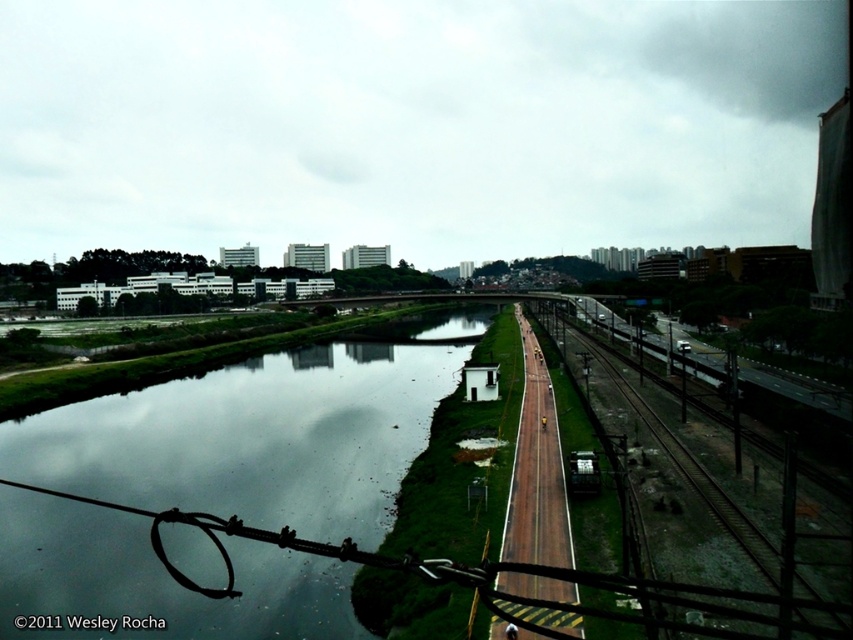
Can you confirm if reflective glass water at center is positioned to the right of brown wooden train track at center?

No, reflective glass water at center is not to the right of brown wooden train track at center.

Is point (238, 364) less distant than point (637, 397)?

No, it is behind (637, 397).

The image size is (853, 640). Find the location of `reflective glass water at center`. reflective glass water at center is located at coordinates (260, 433).